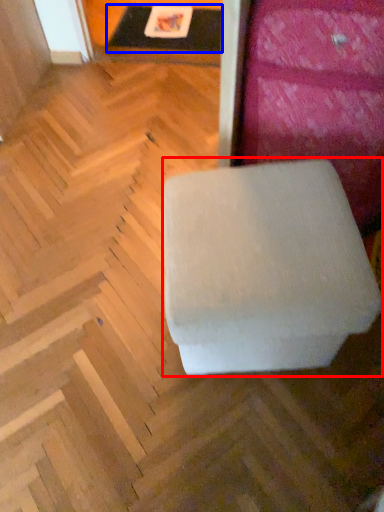
Question: Which object is further to the camera taking this photo, furniture (highlighted by a red box) or table (highlighted by a blue box)?

Choices:
 (A) furniture
 (B) table

Answer: (B)